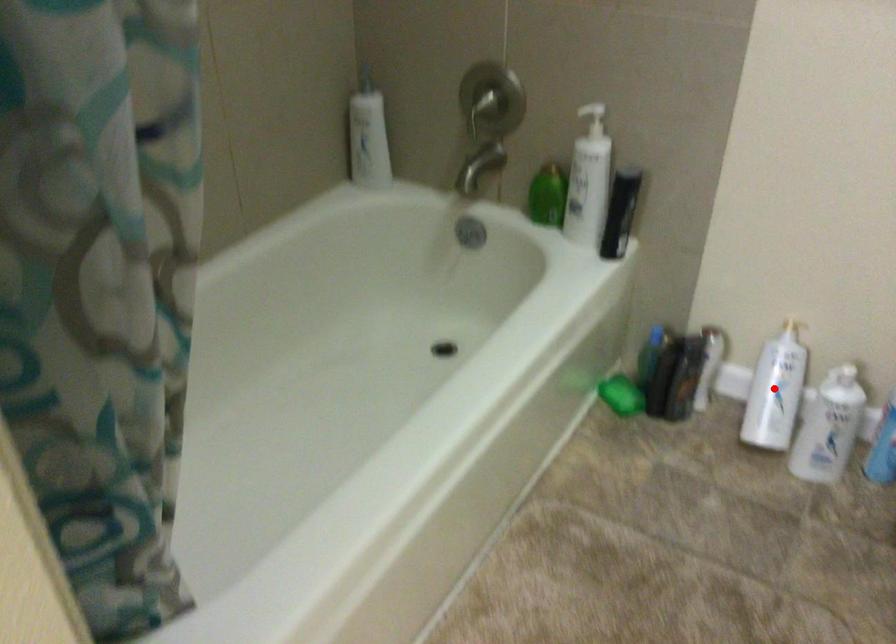
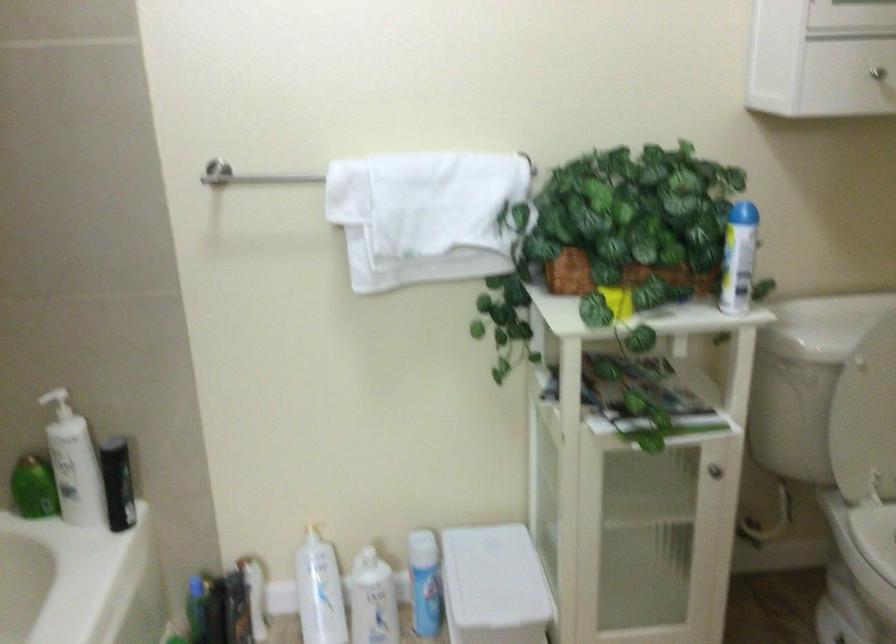
Locate, in the second image, the point that corresponds to the highlighted location in the first image.

(319, 591)